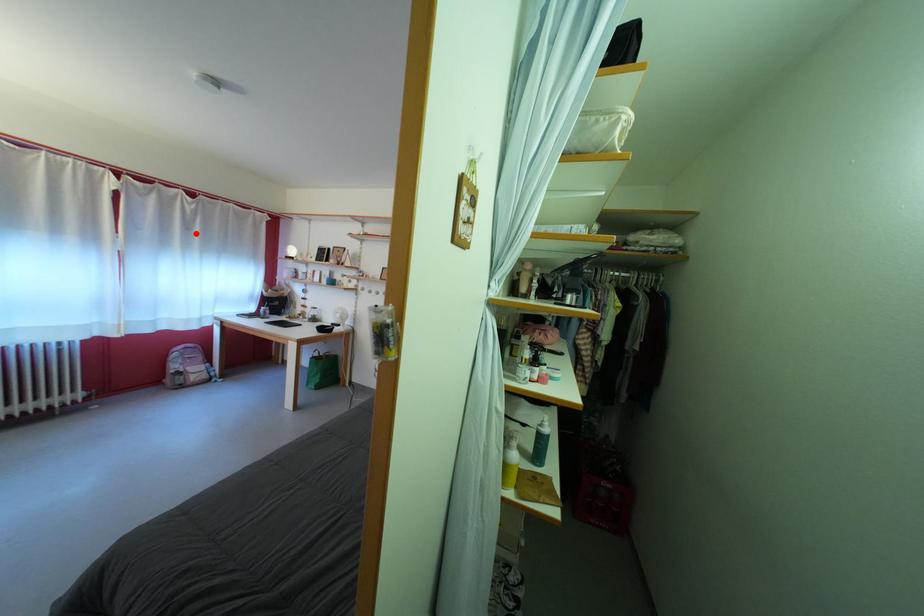
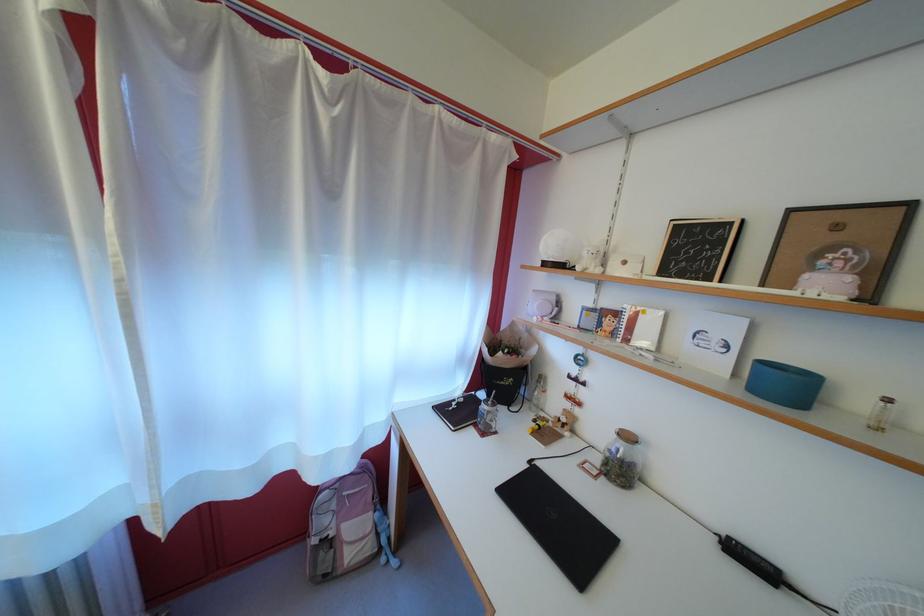
Locate, in the second image, the point that corresponds to the highlighted location in the first image.

(335, 193)